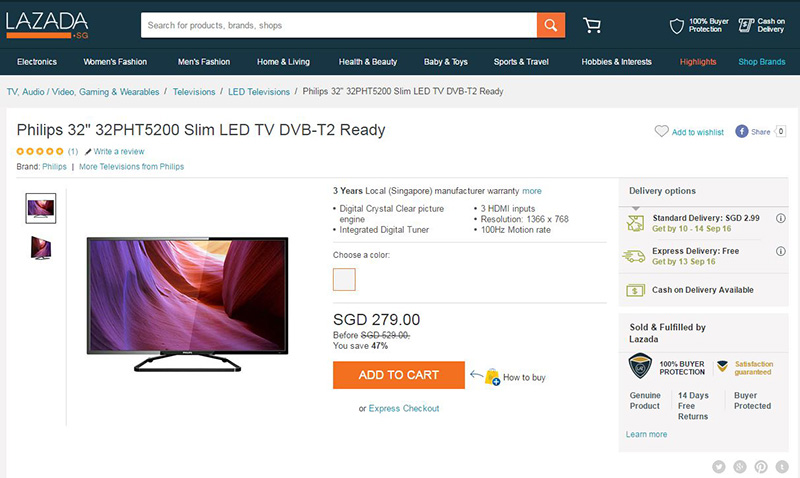
At what (x,y) coordinates should I click in order to perform the action: click on screens. Please return your answer as a coordinate pair (x, y). Looking at the image, I should click on (220, 296), (36, 205), (38, 247).